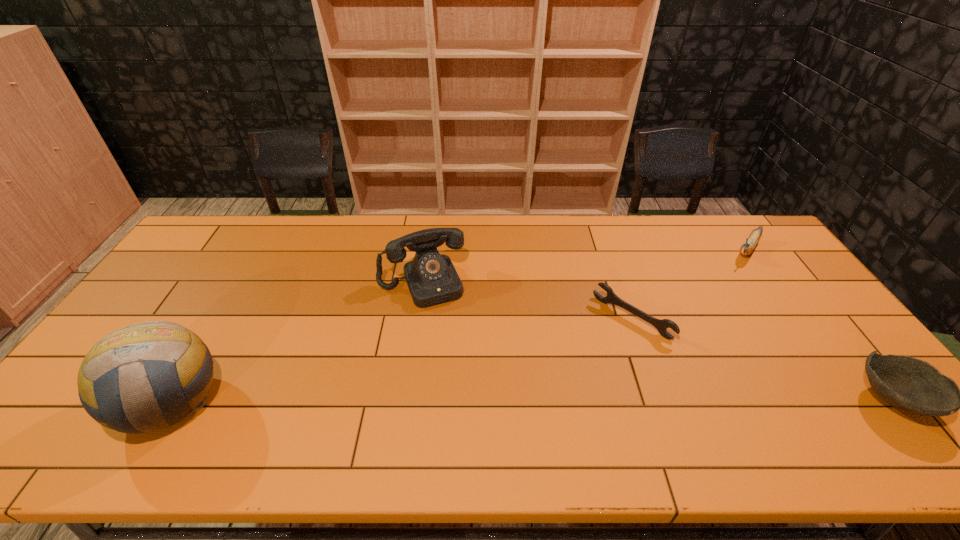
The height and width of the screenshot is (540, 960). Identify the location of vacant position located 0.350m on the dial of the telephone. (471, 405).

This screenshot has width=960, height=540. I want to click on free spot located on the dial of the telephone, so click(x=441, y=326).

Where is `free space located 0.180m on the dial of the telephone`? This screenshot has height=540, width=960. free space located 0.180m on the dial of the telephone is located at coordinates (451, 352).

Locate an element on the screen. This screenshot has height=540, width=960. free region located on the open ends of the shortest object is located at coordinates (571, 380).

Locate an element on the screen. blank space located 0.340m on the open ends of the shortest object is located at coordinates (537, 416).

At what (x,y) coordinates should I click in order to perform the action: click on free space located 0.070m on the open ends of the shortest object. Please return your answer as a coordinate pair (x, y). This screenshot has width=960, height=540. Looking at the image, I should click on (599, 351).

This screenshot has height=540, width=960. In order to click on vacant position located at the stem of the banana in this screenshot , I will do `click(701, 312)`.

I want to click on free region located at the stem of the banana, so click(x=720, y=286).

At what (x,y) coordinates should I click in order to perform the action: click on free region located at the stem of the banana. Please return your answer as a coordinate pair (x, y). The width and height of the screenshot is (960, 540). Looking at the image, I should click on (711, 298).

Identify the location of object located in the far edge section of the desktop. (749, 245).